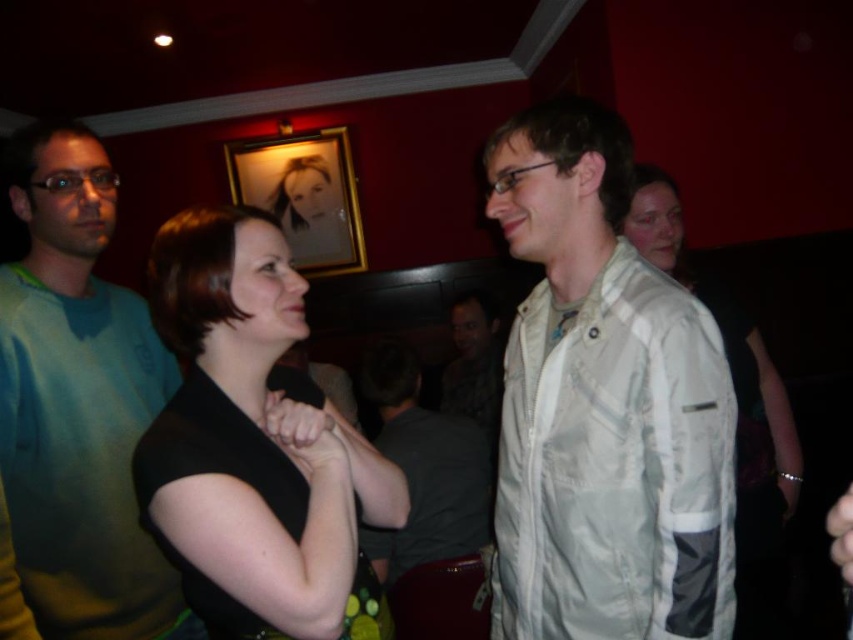
Question: Which object appears closest to the camera in this image?

Choices:
 (A) black matte dress at center
 (B) camouflage jacket at center
 (C) light beige fabric shirt at center

Answer: (A)

Question: Which of the following is the closest to the observer?

Choices:
 (A) black matte dress at center
 (B) camouflage jacket at center
 (C) light beige fabric shirt at center

Answer: (A)

Question: Which of the following is the farthest from the observer?

Choices:
 (A) camouflage jacket at center
 (B) black matte dress at center

Answer: (A)

Question: Can you confirm if light gray fabric jacket at center is positioned to the left of black matte dress at center?

Choices:
 (A) no
 (B) yes

Answer: (A)

Question: Is light gray fabric jacket at center closer to the viewer compared to black matte dress at center?

Choices:
 (A) yes
 (B) no

Answer: (B)

Question: Does black matte dress at center appear on the left side of teal fleece sweater at left?

Choices:
 (A) yes
 (B) no

Answer: (B)